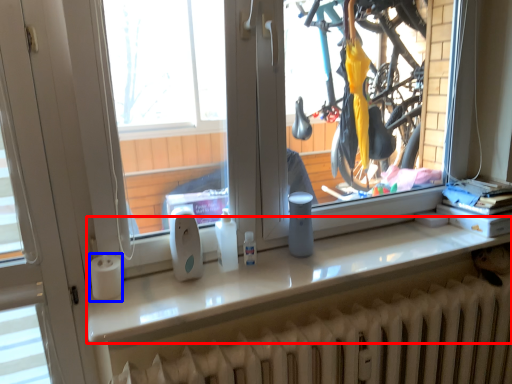
Question: Which point is further to the camera, counter top (highlighted by a red box) or paper towel (highlighted by a blue box)?

Choices:
 (A) counter top
 (B) paper towel

Answer: (B)